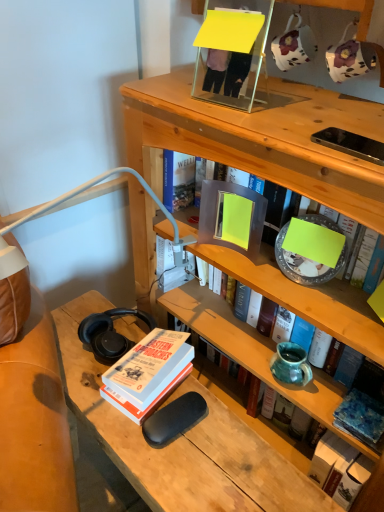
Question: Considering the relative positions of hardcover book at upper center, which is counted as the 2th book, starting from the top, and hardcover book at lower left, which is the 3th book in top-to-bottom order, in the image provided, is hardcover book at upper center, which is counted as the 2th book, starting from the top, behind hardcover book at lower left, which is the 3th book in top-to-bottom order,?

Choices:
 (A) yes
 (B) no

Answer: (B)

Question: Considering the relative sizes of hardcover book at upper center, which is counted as the 2th book, starting from the top, and hardcover book at lower left, which is the 3th book in top-to-bottom order, in the image provided, is hardcover book at upper center, which is counted as the 2th book, starting from the top, smaller than hardcover book at lower left, which is the 3th book in top-to-bottom order,?

Choices:
 (A) no
 (B) yes

Answer: (A)

Question: Can you confirm if hardcover book at upper center, which is counted as the 2th book, starting from the top, is positioned to the right of hardcover book at lower left, acting as the 2th book starting from the bottom?

Choices:
 (A) no
 (B) yes

Answer: (B)

Question: Is hardcover book at upper center, which is the third book in bottom-to-top order, aimed at hardcover book at lower left, which is the 3th book in top-to-bottom order?

Choices:
 (A) no
 (B) yes

Answer: (B)

Question: Is hardcover book at upper center, which is the third book in bottom-to-top order, not close to hardcover book at lower left, acting as the 2th book starting from the bottom?

Choices:
 (A) no
 (B) yes

Answer: (A)

Question: From a real-world perspective, is hardcover book at upper center, which is the third book in bottom-to-top order, located higher than hardcover book at lower left, acting as the 2th book starting from the bottom?

Choices:
 (A) yes
 (B) no

Answer: (A)

Question: Is blue textured fabric at lower right, marked as the 4th book in a top-to-bottom arrangement, aimed at matte gray book at center, arranged as the first book when viewed from the top?

Choices:
 (A) yes
 (B) no

Answer: (B)

Question: Can you confirm if blue textured fabric at lower right, placed as the first book when sorted from bottom to top, is taller than matte gray book at center, placed as the 4th book when sorted from bottom to top?

Choices:
 (A) no
 (B) yes

Answer: (A)

Question: Is blue textured fabric at lower right, placed as the first book when sorted from bottom to top, thinner than matte gray book at center, arranged as the first book when viewed from the top?

Choices:
 (A) no
 (B) yes

Answer: (B)

Question: Does blue textured fabric at lower right, placed as the first book when sorted from bottom to top, have a smaller size compared to matte gray book at center, placed as the 4th book when sorted from bottom to top?

Choices:
 (A) yes
 (B) no

Answer: (A)

Question: Is blue textured fabric at lower right, placed as the first book when sorted from bottom to top, positioned beyond the bounds of matte gray book at center, placed as the 4th book when sorted from bottom to top?

Choices:
 (A) yes
 (B) no

Answer: (A)

Question: Does blue textured fabric at lower right, placed as the first book when sorted from bottom to top, touch matte gray book at center, placed as the 4th book when sorted from bottom to top?

Choices:
 (A) no
 (B) yes

Answer: (A)

Question: Can you confirm if teal ceramic vase at middle right is wider than hardcover book at upper center, which is the third book in bottom-to-top order?

Choices:
 (A) yes
 (B) no

Answer: (B)